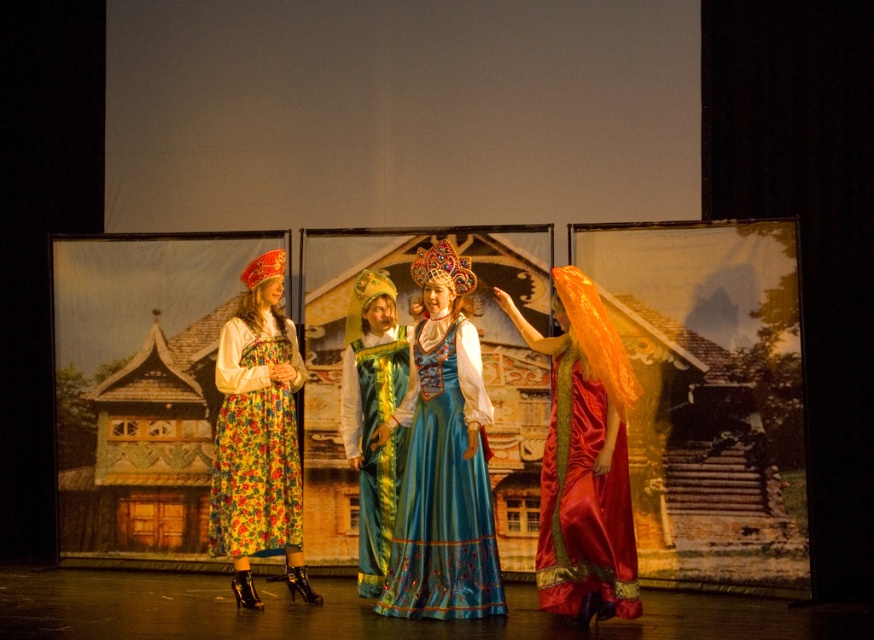
Between floral fabric dress at left and velvet teal dress at center, which one is positioned higher?

floral fabric dress at left

Who is positioned more to the left, floral fabric dress at left or velvet teal dress at center?

floral fabric dress at left

Is point (272, 410) positioned after point (380, 561)?

No, (272, 410) is in front of (380, 561).

Where is `floral fabric dress at left`? The width and height of the screenshot is (874, 640). floral fabric dress at left is located at coordinates (x=255, y=444).

Measure the distance between blue satin dress at center and velvet teal dress at center.

blue satin dress at center is 20.12 inches from velvet teal dress at center.

Can you confirm if blue satin dress at center is bigger than velvet teal dress at center?

Yes.

The width and height of the screenshot is (874, 640). What are the coordinates of `blue satin dress at center` in the screenshot? It's located at (442, 502).

The height and width of the screenshot is (640, 874). Identify the location of blue satin dress at center. (442, 502).

Does shiny red silk dress at right lie behind velvet teal dress at center?

No, shiny red silk dress at right is in front of velvet teal dress at center.

Does point (615, 541) come farther from viewer compared to point (369, 417)?

No, it is not.

You are a GUI agent. You are given a task and a screenshot of the screen. Output one action in this format:
    pyautogui.click(x=<x>, y=<y>)
    Task: Click on the shiny red silk dress at right
    The height and width of the screenshot is (640, 874).
    Given the screenshot: What is the action you would take?
    pyautogui.click(x=584, y=500)